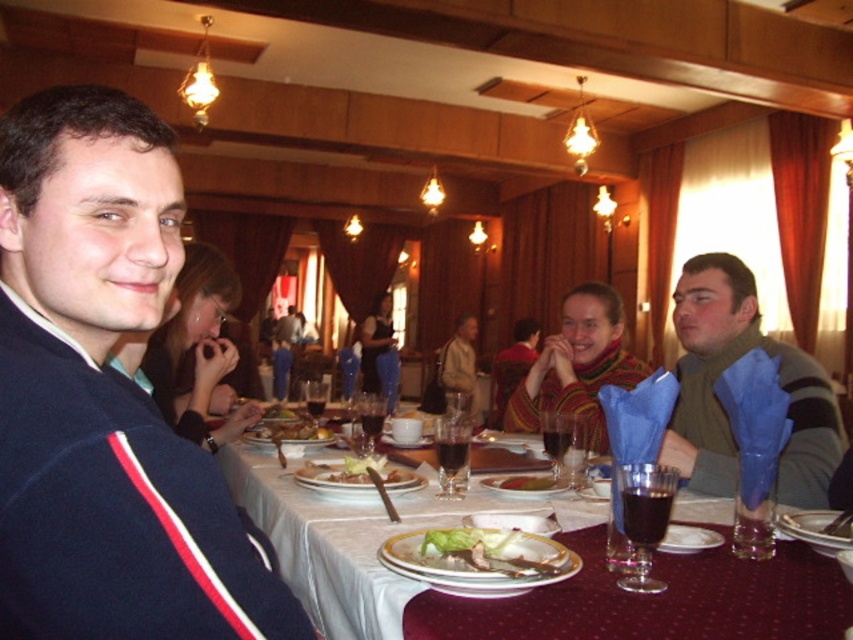
Does navy blue sweater at left have a lesser height compared to white porcelain plate at center?

Incorrect, navy blue sweater at left's height does not fall short of white porcelain plate at center's.

Find the location of a particular element. This screenshot has width=853, height=640. navy blue sweater at left is located at coordinates click(x=106, y=397).

Which is more to the right, white porcelain plate at center or golden brown bread at center?

white porcelain plate at center is more to the right.

Does white porcelain plate at center lie in front of golden brown bread at center?

Yes.

Is point (416, 480) farther from viewer compared to point (283, 432)?

That is False.

At what (x,y) coordinates should I click in order to perform the action: click on white porcelain plate at center. Please return your answer as a coordinate pair (x, y). Looking at the image, I should click on (355, 474).

Is point (674, 429) positioned in front of point (328, 435)?

Yes, it is.

Is green fuzzy sweater at right further to camera compared to golden brown bread at center?

No, green fuzzy sweater at right is closer to the viewer.

What do you see at coordinates (718, 401) in the screenshot? I see `green fuzzy sweater at right` at bounding box center [718, 401].

At what (x,y) coordinates should I click in order to perform the action: click on green fuzzy sweater at right. Please return your answer as a coordinate pair (x, y). Looking at the image, I should click on point(718,401).